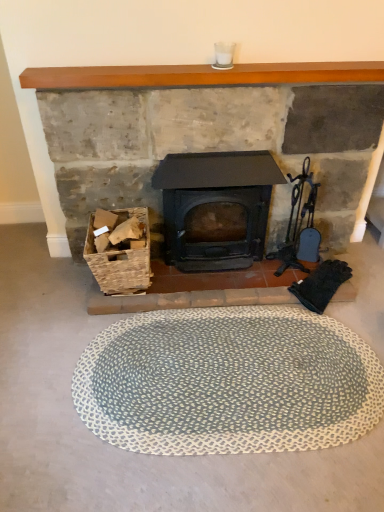
Identify the location of free location in front of woven wood basket at lower left. Image resolution: width=384 pixels, height=512 pixels. (134, 322).